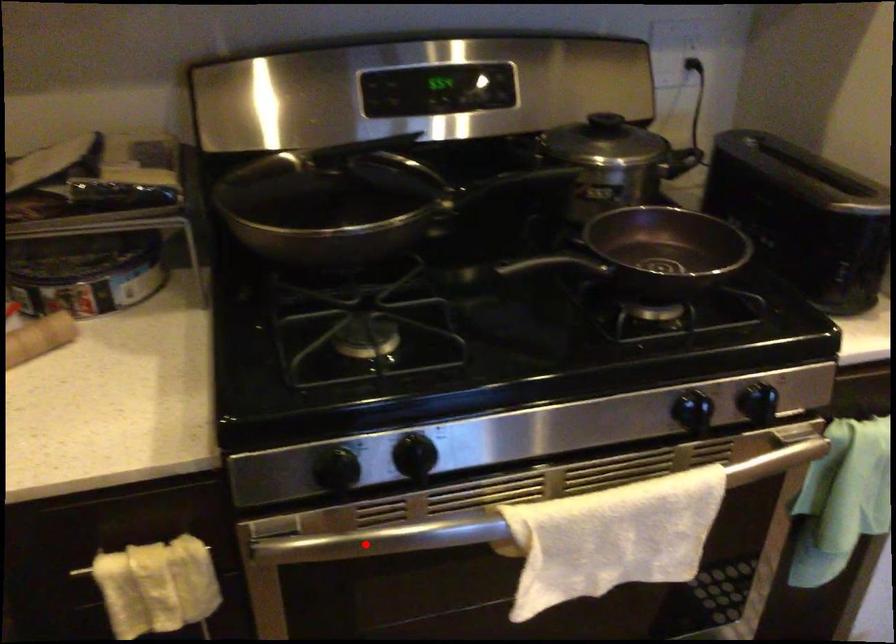
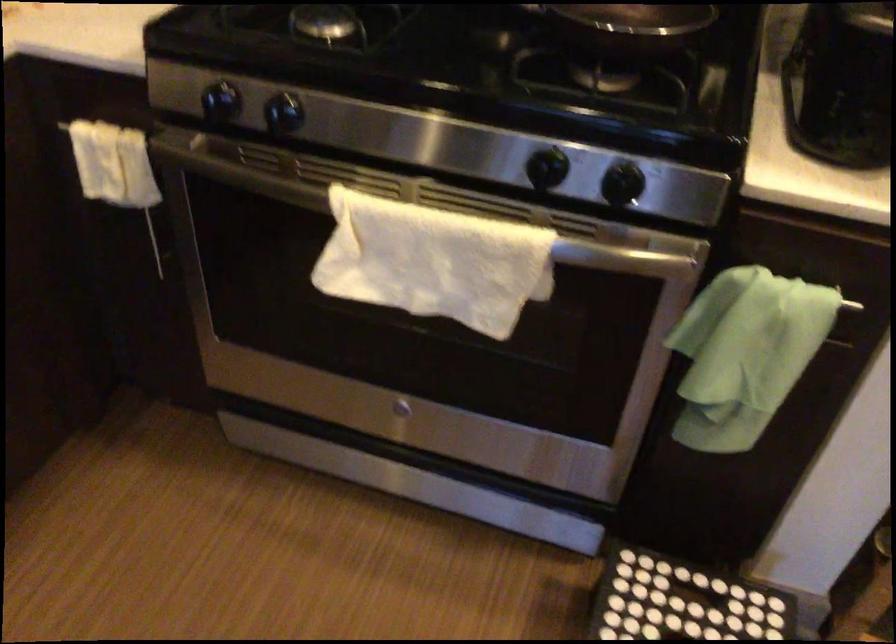
Question: I am providing you with two images of the same scene from different viewpoints. In image1, a red point is highlighted. Considering the same 3D point in image2, which of the following is correct?

Choices:
 (A) It is closer
 (B) It is farther

Answer: (B)